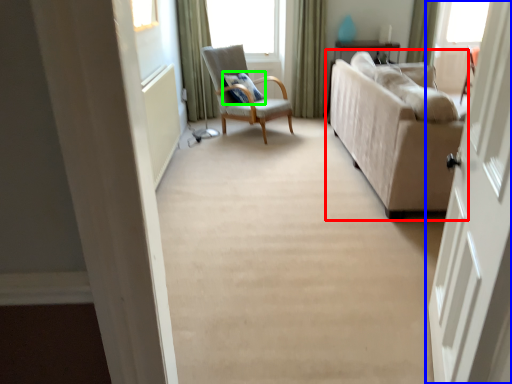
Question: Which object is the closest to the studio couch (highlighted by a red box)? Choose among these: door (highlighted by a blue box) or pillow (highlighted by a green box).

Choices:
 (A) door
 (B) pillow

Answer: (A)